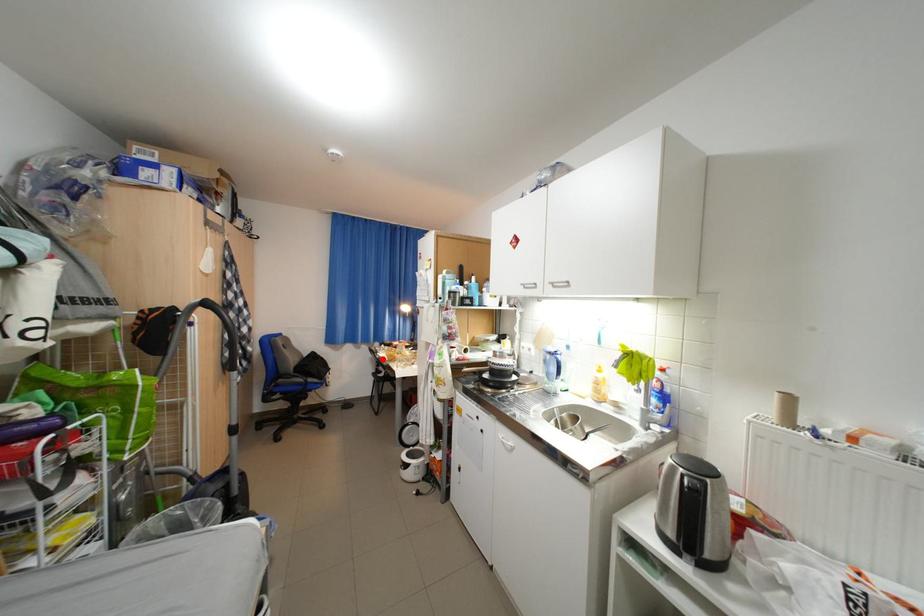
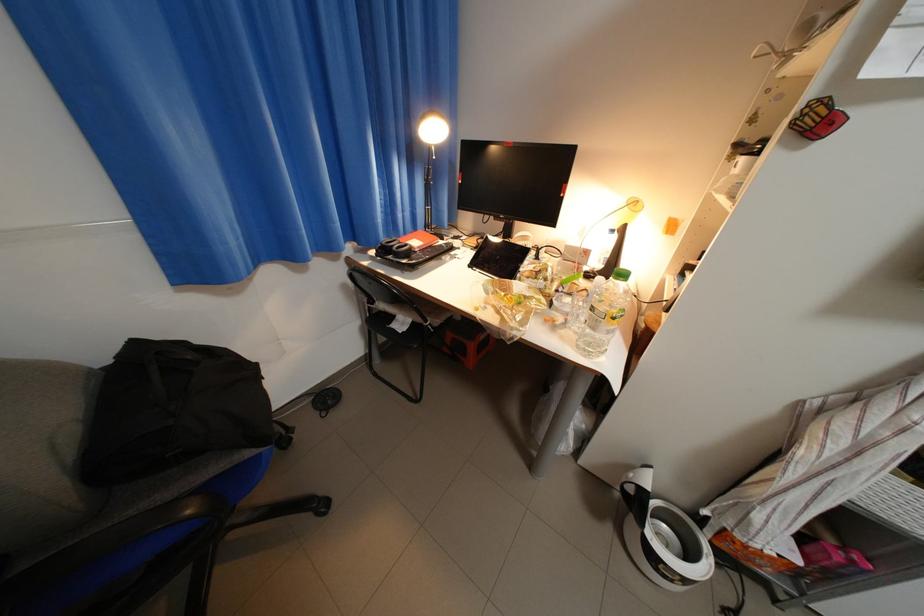
The point at the highlighted location is marked in the first image. Where is the corresponding point in the second image?

(355, 286)